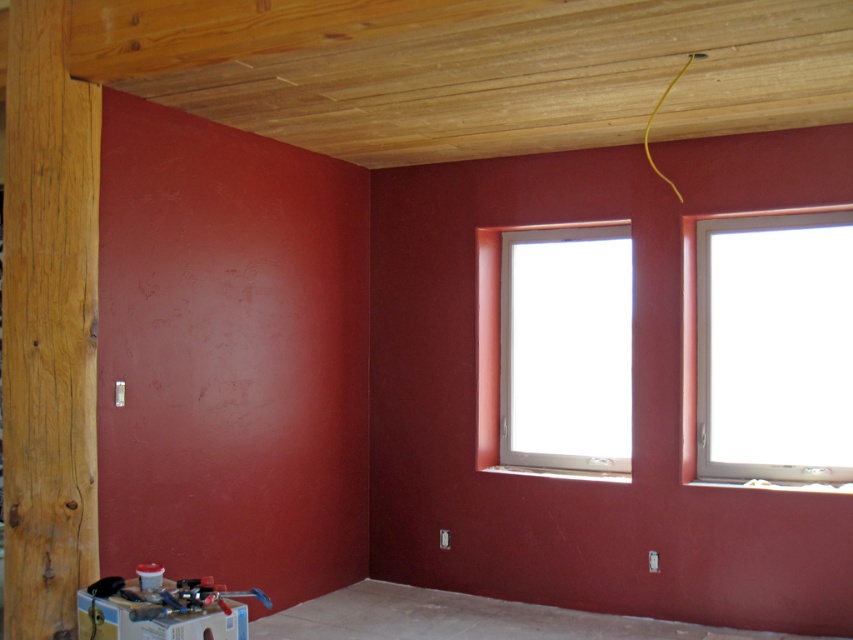
You are standing in the construction area and need to reach the white plastic window at center to check its installation. The natural wood pillar at left is blocking your path. Can you go around it to access the window?

The natural wood pillar at left is above the white plastic window at center, so you can go around the pillar to access the window since it is elevated and not directly in front of it.

From the picture: You are standing in the construction area and want to reach the point closer to you. Which coordinate should you head towards, point (x=752, y=419) or point (x=532, y=346)?

You should head towards point (x=752, y=419) because it is closer to you than point (x=532, y=346).